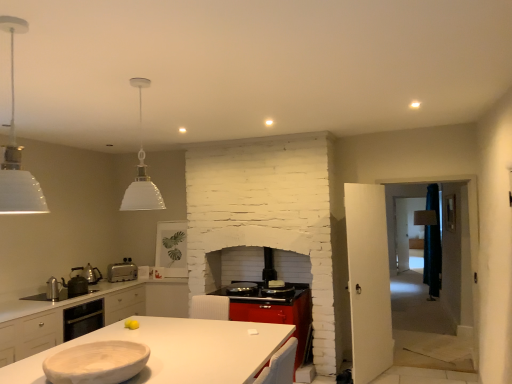
Locate an element on the screen. This screenshot has width=512, height=384. free space above white matte countertop at center (from a real-world perspective) is located at coordinates point(209,350).